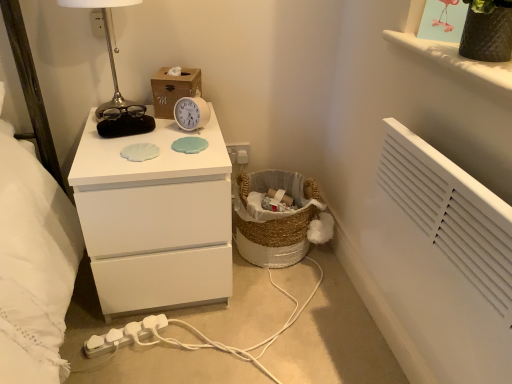
Identify the location of free point behind white plastic extension cord at lower left. This screenshot has width=512, height=384. (135, 320).